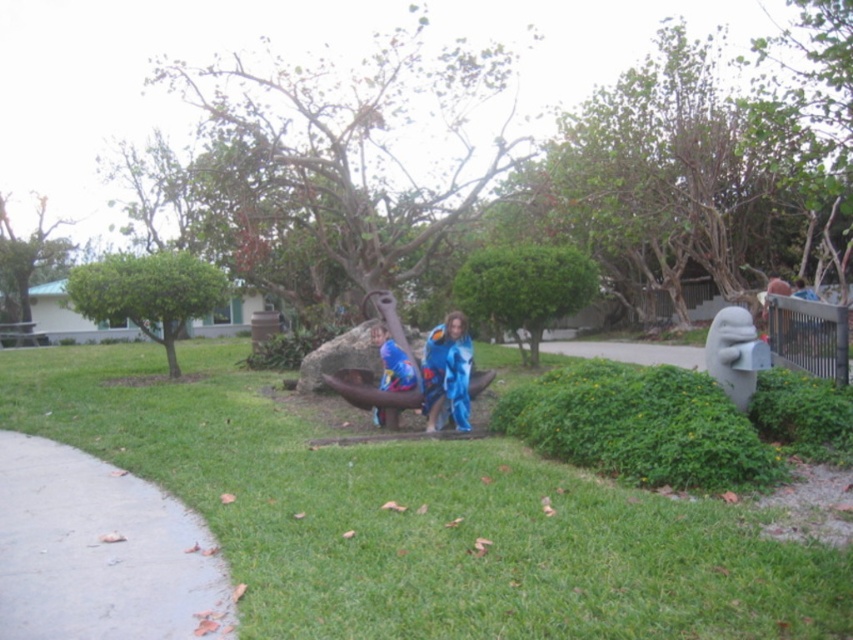
Question: Does green leafy bush at center have a larger size compared to blue fabric costume at center?

Choices:
 (A) no
 (B) yes

Answer: (B)

Question: Which point is closer to the camera?

Choices:
 (A) (439, 412)
 (B) (491, 272)
 (C) (144, 464)
 (D) (171, 262)

Answer: (C)

Question: Does green leafy hedge at upper left appear on the left side of blue fabric at center?

Choices:
 (A) no
 (B) yes

Answer: (B)

Question: Which object is closer to the camera taking this photo?

Choices:
 (A) blue fabric costume at center
 (B) blue fabric at center
 (C) green grass at center

Answer: (C)

Question: Can you confirm if green leafy hedge at upper left is wider than green leafy bush at center?

Choices:
 (A) no
 (B) yes

Answer: (B)

Question: Among these points, which one is nearest to the camera?

Choices:
 (A) (x=396, y=413)
 (B) (x=183, y=259)
 (C) (x=453, y=278)

Answer: (A)